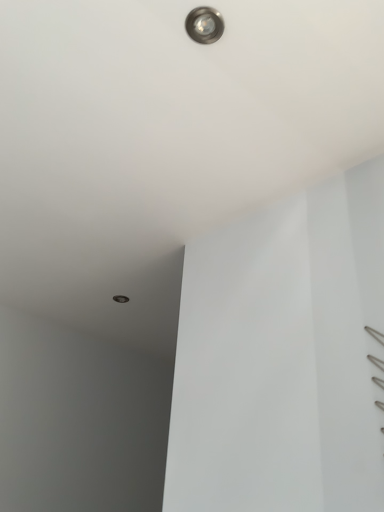
Find the location of a particular element. This screenshot has height=512, width=384. satin silver droplight at upper center is located at coordinates (204, 25).

What do you see at coordinates (204, 25) in the screenshot? This screenshot has height=512, width=384. I see `satin silver droplight at upper center` at bounding box center [204, 25].

At what (x,y) coordinates should I click in order to perform the action: click on satin silver droplight at upper center. Please return your answer as a coordinate pair (x, y). This screenshot has height=512, width=384. Looking at the image, I should click on (204, 25).